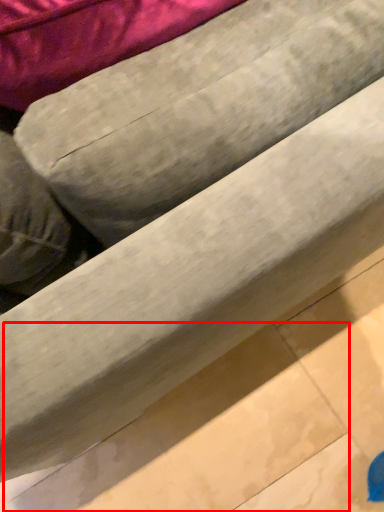
Question: From the image's perspective, where is tile (annotated by the red box) located in relation to bean bag chair in the image?

Choices:
 (A) below
 (B) above

Answer: (A)